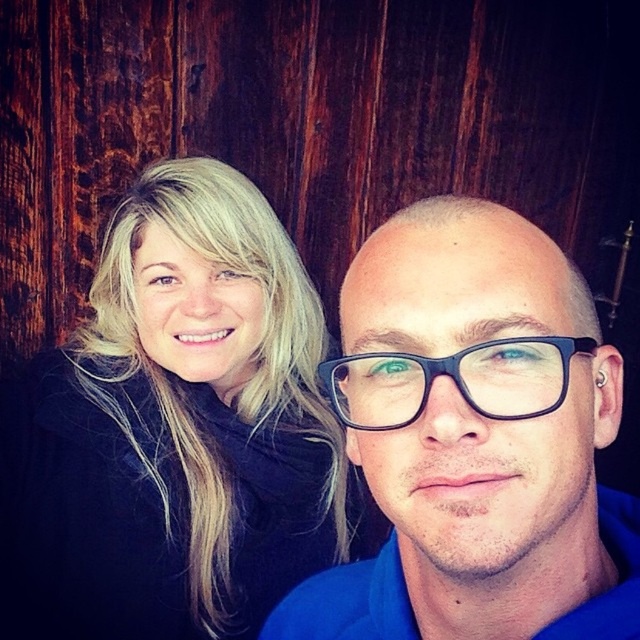
You are a photographer trying to adjust the lighting in the scene. You notice the blonde hair at upper left and the black plastic glasses at center. Which object should you focus your spotlight on to ensure both are well lit, considering their size and position?

The blonde hair at upper left is much taller than the black plastic glasses at center, so focusing the spotlight on the blonde hair at upper left would better illuminate both objects due to its larger size and elevated position.

You are an AI analyzing a portrait photo. The scene shows two people posing against a rustic wooden background. You need to determine the exact 2D coordinates of the blonde hair at upper left in the image. What are its coordinates?

The blonde hair at upper left is located at the 2D coordinates of point (173, 429).

You are a photographer adjusting the camera focus. The camera can only focus on objects within a 15 inch range. Given the distance between the blonde hair at upper left and the blue matte glasses at center, will both subjects be in focus?

The distance between the blonde hair at upper left and the blue matte glasses at center is 17.26 inches, which exceeds the camera focus range of 15 inches. Therefore, both subjects cannot be in focus simultaneously.